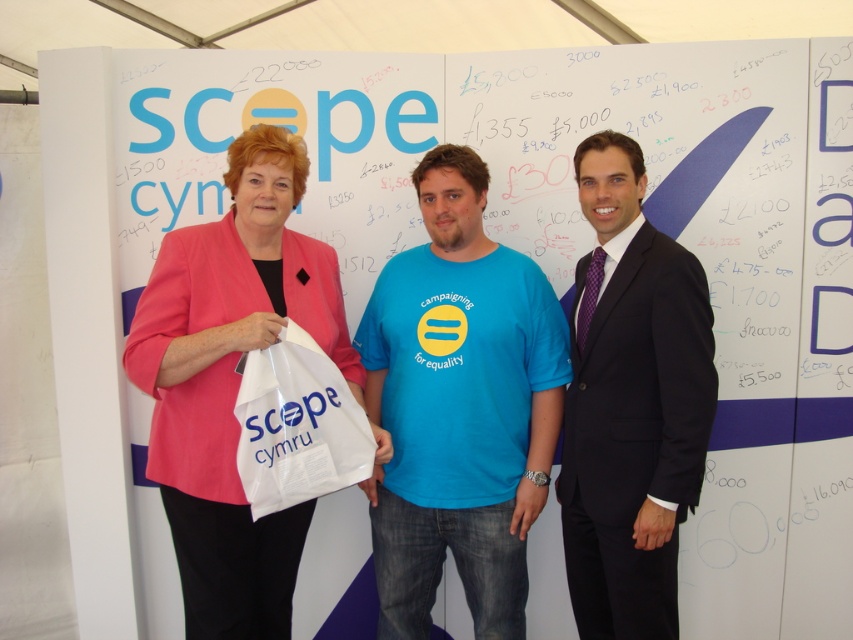
Which is in front, point (257, 237) or point (691, 440)?

Point (691, 440) is in front.

Is point (221, 550) positioned before point (618, 563)?

Yes, it is.

Describe the element at coordinates (231, 381) in the screenshot. I see `pink fabric jacket at center` at that location.

Find the location of a particular element. pink fabric jacket at center is located at coordinates (231, 381).

Which is below, pink fabric jacket at center or white plastic bag at center?

white plastic bag at center

Does pink fabric jacket at center appear on the left side of white plastic bag at center?

Yes, pink fabric jacket at center is to the left of white plastic bag at center.

Is point (144, 380) less distant than point (251, 477)?

No.

What are the coordinates of `pink fabric jacket at center` in the screenshot? It's located at (231, 381).

Who is higher up, blue cotton t-shirt at center or white plastic bag at center?

A: blue cotton t-shirt at center is above.

Based on the photo, is blue cotton t-shirt at center bigger than white plastic bag at center?

Yes, blue cotton t-shirt at center is bigger than white plastic bag at center.

Between point (532, 506) and point (293, 336), which one is positioned in front?

Point (293, 336) is in front.

Identify the location of blue cotton t-shirt at center. The image size is (853, 640). (459, 406).